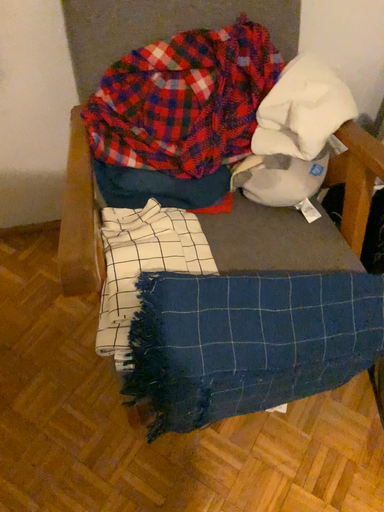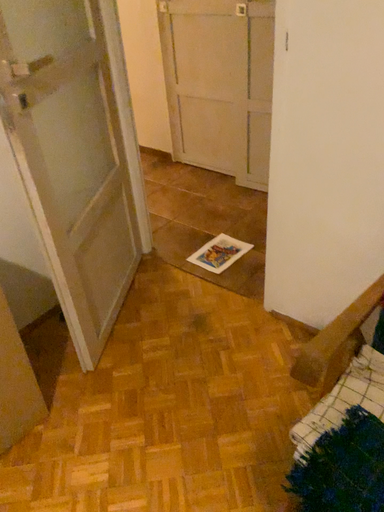
Question: Which way did the camera rotate in the video?

Choices:
 (A) rotated left
 (B) rotated right

Answer: (A)